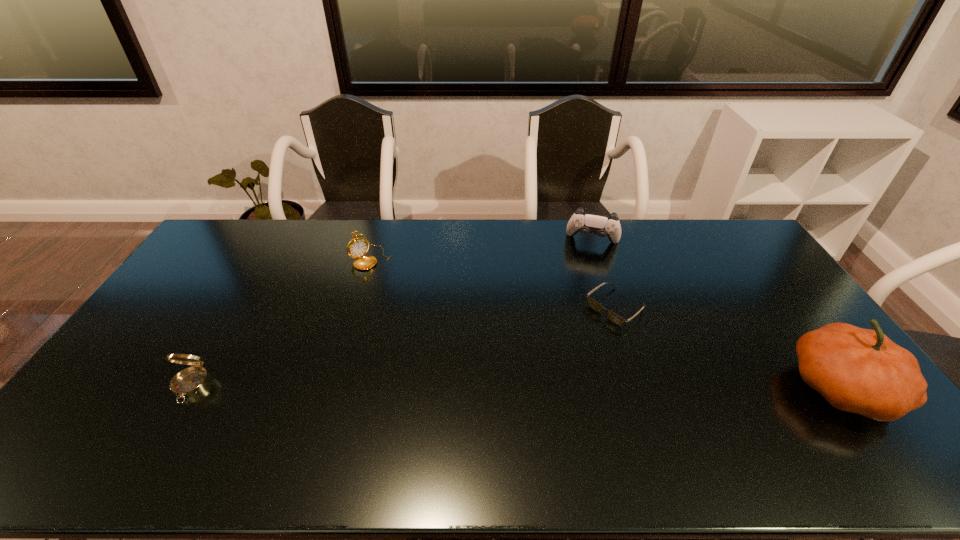
Find the location of a particular element. pumpkin at the near edge is located at coordinates (857, 370).

I want to click on object at the right edge, so point(857,370).

Find the location of `object present at the near right corner`. object present at the near right corner is located at coordinates (857, 370).

In the image, there is a desktop. Where is `free space at the far edge`? free space at the far edge is located at coordinates (321, 250).

In the image, there is a desktop. At what (x,y) coordinates should I click in order to perform the action: click on vacant space at the near edge. Please return your answer as a coordinate pair (x, y). Looking at the image, I should click on (525, 422).

In order to click on vacant space at the right edge of the desktop in this screenshot , I will do `click(761, 296)`.

Locate an element on the screen. The image size is (960, 540). free space at the far left corner of the desktop is located at coordinates (245, 220).

You are a GUI agent. You are given a task and a screenshot of the screen. Output one action in this format:
    pyautogui.click(x=<x>, y=<y>)
    Task: Click on the free spot at the far right corner of the desktop
    This screenshot has height=540, width=960.
    Given the screenshot: What is the action you would take?
    pyautogui.click(x=713, y=239)

The height and width of the screenshot is (540, 960). In order to click on free point between the leftmost object and the rightmost object in this screenshot , I will do `click(516, 387)`.

This screenshot has height=540, width=960. I want to click on empty location between the control and the compass, so click(392, 313).